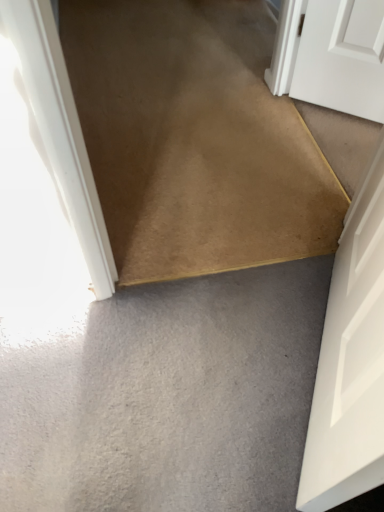
Question: Would you say gray matte carpet at lower center is inside or outside white matte door at lower right?

Choices:
 (A) inside
 (B) outside

Answer: (B)

Question: From a real-world perspective, relative to white matte door at lower right, is gray matte carpet at lower center vertically above or below?

Choices:
 (A) below
 (B) above

Answer: (A)

Question: Which object is the closest to the gray matte carpet at lower center?

Choices:
 (A) white matte door at lower right
 (B) carpet at center

Answer: (A)

Question: Which is nearer to the gray matte carpet at lower center?

Choices:
 (A) carpet at center
 (B) white matte door at lower right

Answer: (B)